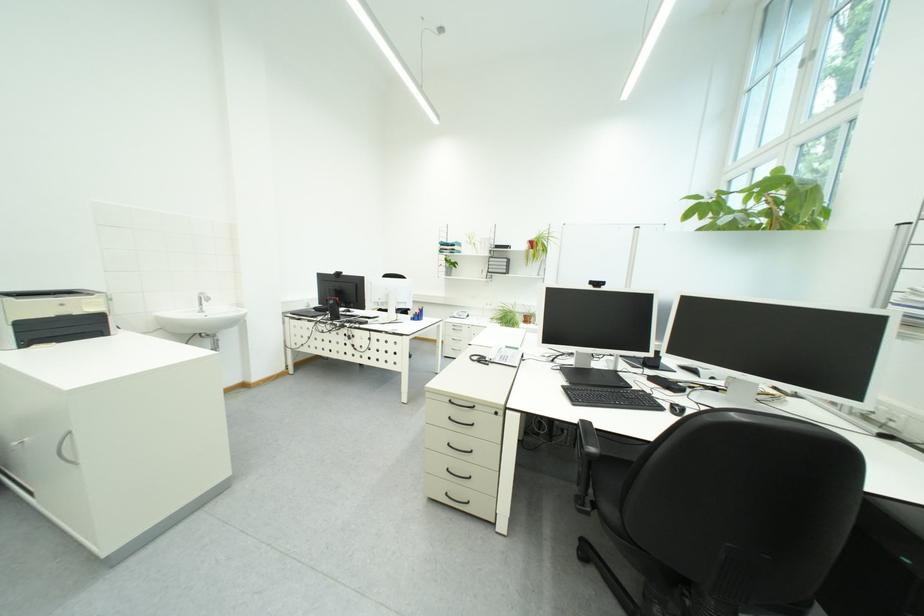
Where would you pull the silver cabinet handle? Please return your answer as a coordinate pair (x, y).

(66, 448)